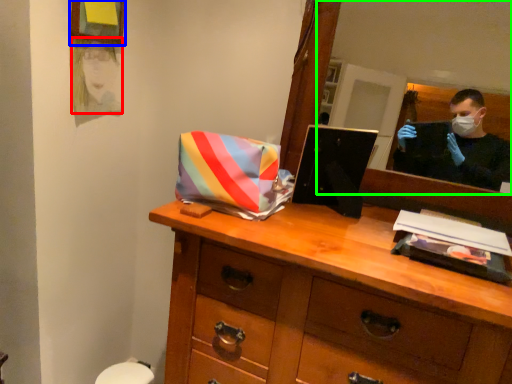
Question: Considering the real-world distances, which object is closest to person (highlighted by a red box)? picture frame (highlighted by a blue box) or mirror (highlighted by a green box).

Choices:
 (A) picture frame
 (B) mirror

Answer: (A)